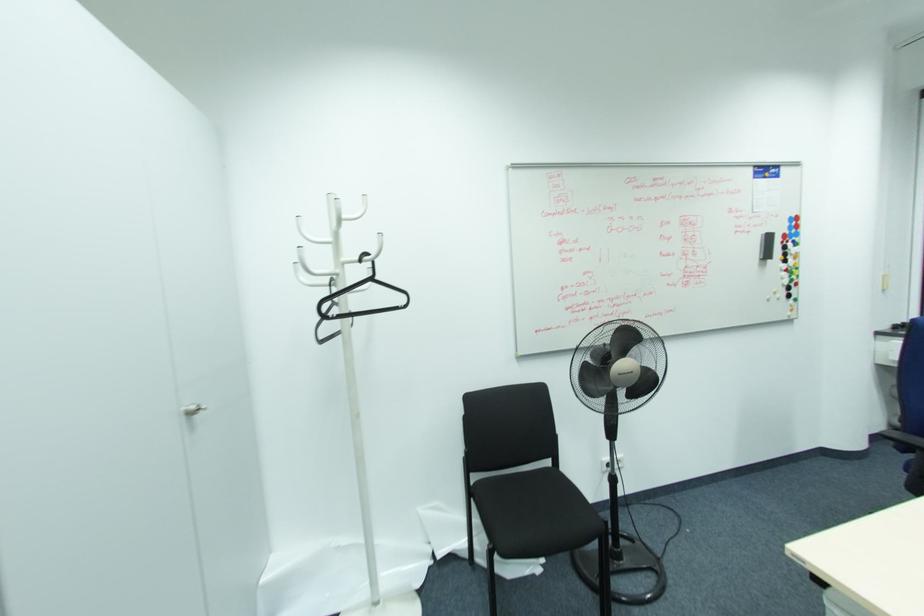
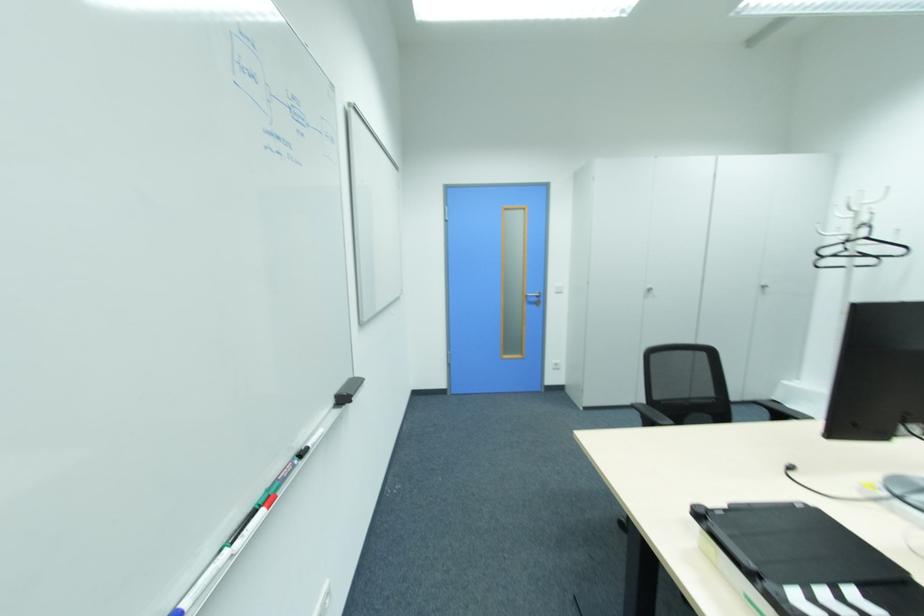
Locate, in the second image, the point that corresponds to (191,408) in the first image.

(764, 285)